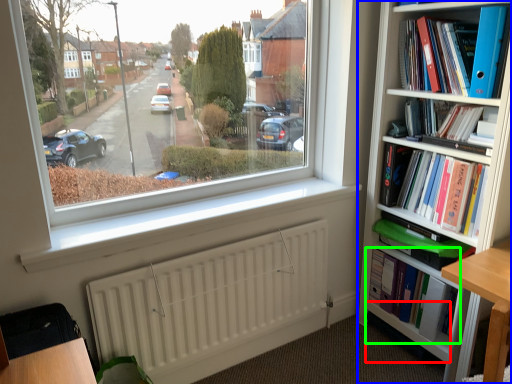
Question: Considering the real-world distances, which object is closest to shelf (highlighted by a red box)? bookcase (highlighted by a blue box) or book (highlighted by a green box).

Choices:
 (A) bookcase
 (B) book

Answer: (B)